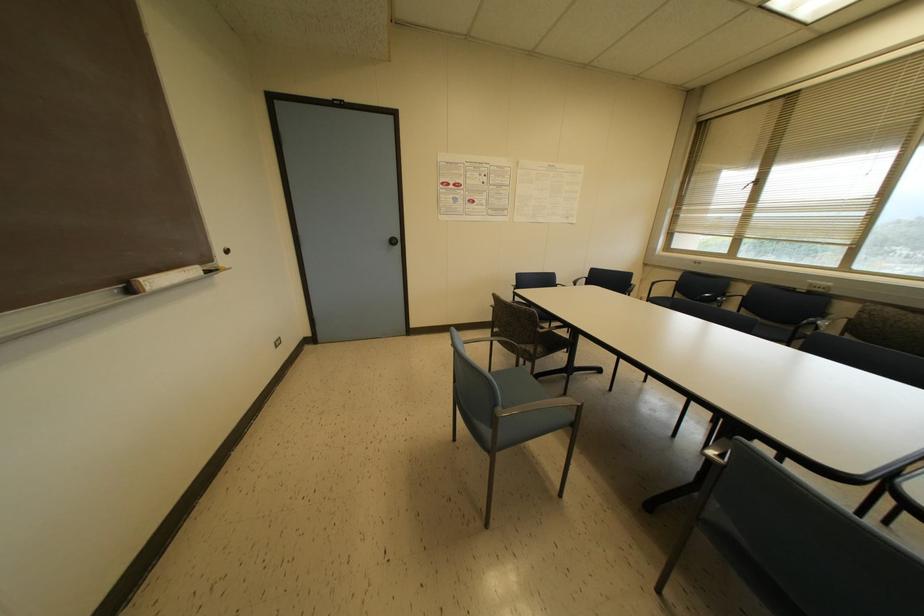
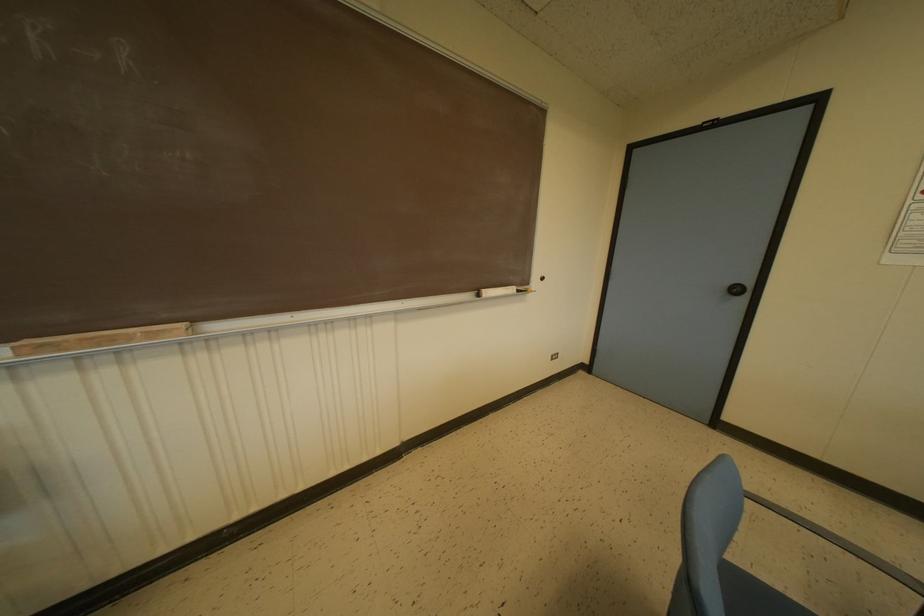
The point at (397,241) is marked in the first image. Where is the corresponding point in the second image?

(746, 291)